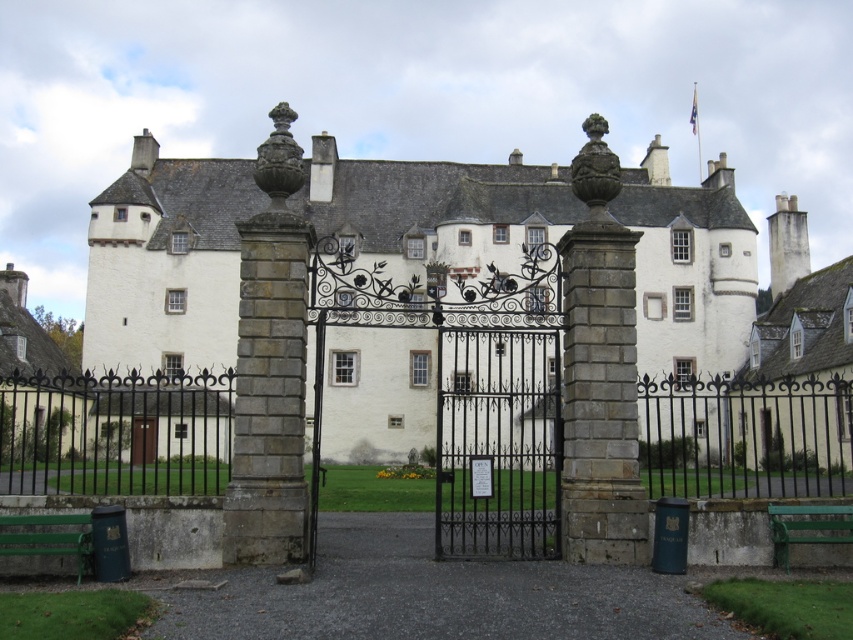
You are a visitor approaching the brown wooden door at center and need to sit down to rest. There is a green painted wood park bench at lower right. Based on the scene description, is the bench located higher or lower than the door?

The green painted wood park bench at lower right is above brown wooden door at center, so the bench is located higher than the door.

You are a visitor arriving at the historic building and need to sit down for a moment. You see the green wooden bench at lower left and the brown wooden door at center. Which object is shorter in height?

The green wooden bench at lower left has a lesser height compared to the brown wooden door at center, so the green wooden bench at lower left is shorter.